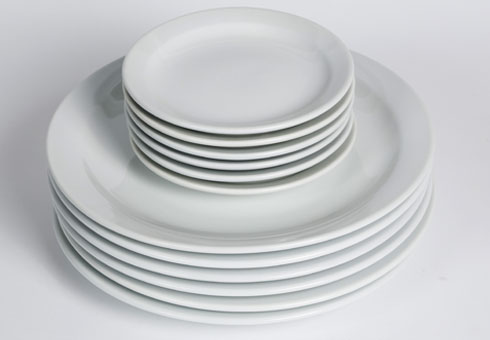
Where is `large plates`? The image size is (490, 340). large plates is located at coordinates (218, 250), (224, 263), (227, 279), (227, 292), (228, 307), (229, 322).